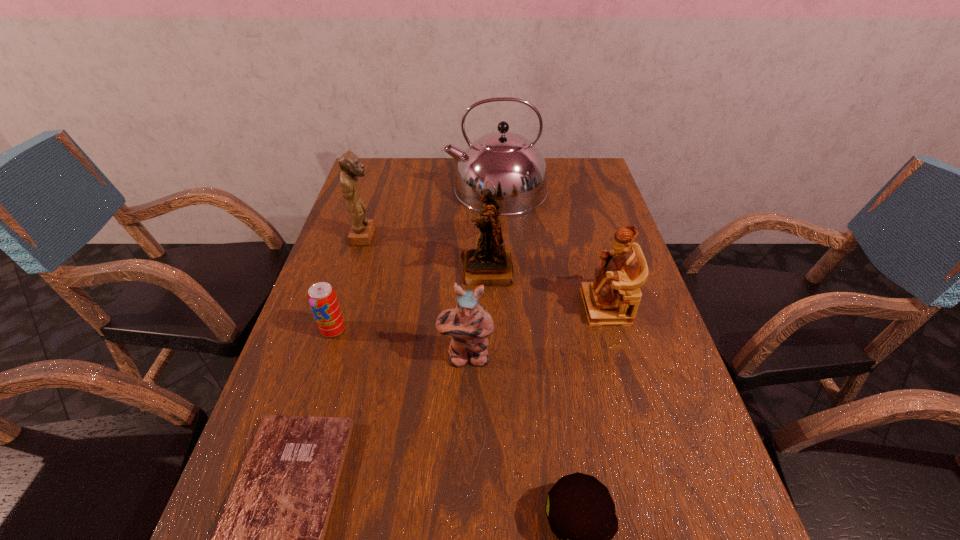
Point out which figurine is positioned as the second nearest to the farthest figurine. Please provide its 2D coordinates. Your answer should be formatted as a tuple, i.e. [(x, y)], where the tuple contains the x and y coordinates of a point satisfying the conditions above.

[(469, 324)]